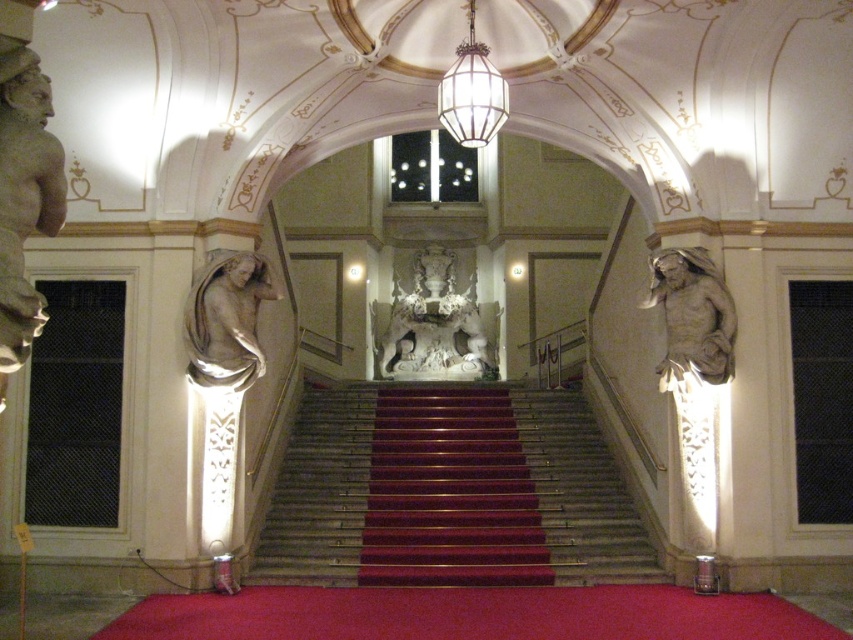
Based on the photo, who is taller, smooth gray stairs at center or clear glass lantern at center?

smooth gray stairs at center

Does point (577, 468) come closer to viewer compared to point (485, 136)?

That is False.

The width and height of the screenshot is (853, 640). In order to click on smooth gray stairs at center in this screenshot , I will do `click(579, 492)`.

Is point (462, 490) positioned in front of point (537, 497)?

No, (462, 490) is further to viewer.

Is shiny red carpet at center below smooth gray stairs at center?

No.

Is point (509, 436) closer to camera compared to point (581, 509)?

No, it is not.

Identify the location of shiny red carpet at center. The width and height of the screenshot is (853, 640). (450, 492).

Consider the image. Can you confirm if white marble sculpture at center is positioned to the right of matte gray statue at left?

Yes, white marble sculpture at center is to the right of matte gray statue at left.

Is white marble sculpture at center to the left of matte gray statue at left from the viewer's perspective?

In fact, white marble sculpture at center is to the right of matte gray statue at left.

This screenshot has width=853, height=640. What are the coordinates of `white marble sculpture at center` in the screenshot? It's located at (434, 324).